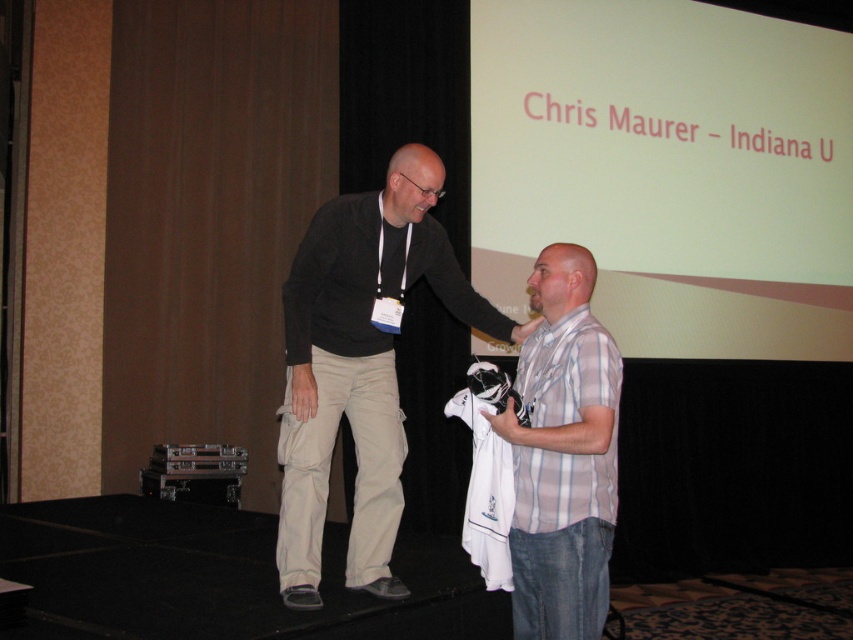
You are an event organizer arranging a photo shoot. You need to place a small podium between the khaki cotton pants at center and the white striped shirt at center. Based on their positions, will the podium fit between them if it requires 1 meter of space?

The khaki cotton pants at center might be wider than white striped shirt at center, but without specific measurements, it is uncertain if the 1 meter space requirement for the podium can be met. Further information is needed to confirm.

You are a photographer standing in front of the stage where two men are positioned. You notice two points marked on the stage at coordinates point (399, 209) and point (541, 323). Which point is closer to your position as the photographer?

Point (399, 209) is closer to your position because it is further to the viewer than point (541, 323).

What is the object located at the coordinates point [360,365] in the image?

The object located at point [360,365] is khaki cotton pants at center.